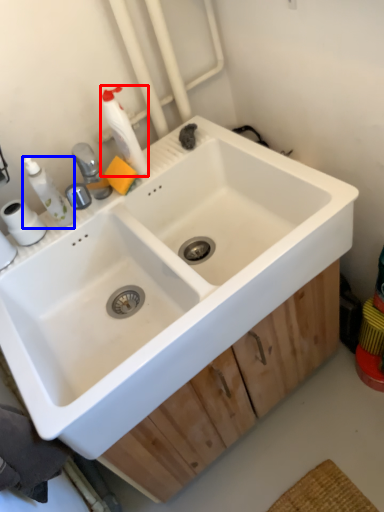
Question: Which point is further to the camera, cleaning product (highlighted by a red box) or toiletry (highlighted by a blue box)?

Choices:
 (A) cleaning product
 (B) toiletry

Answer: (A)